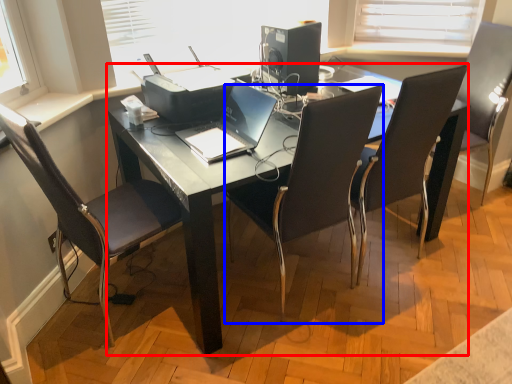
Question: Which point is further to the camera, desk (highlighted by a red box) or chair (highlighted by a blue box)?

Choices:
 (A) desk
 (B) chair

Answer: (A)